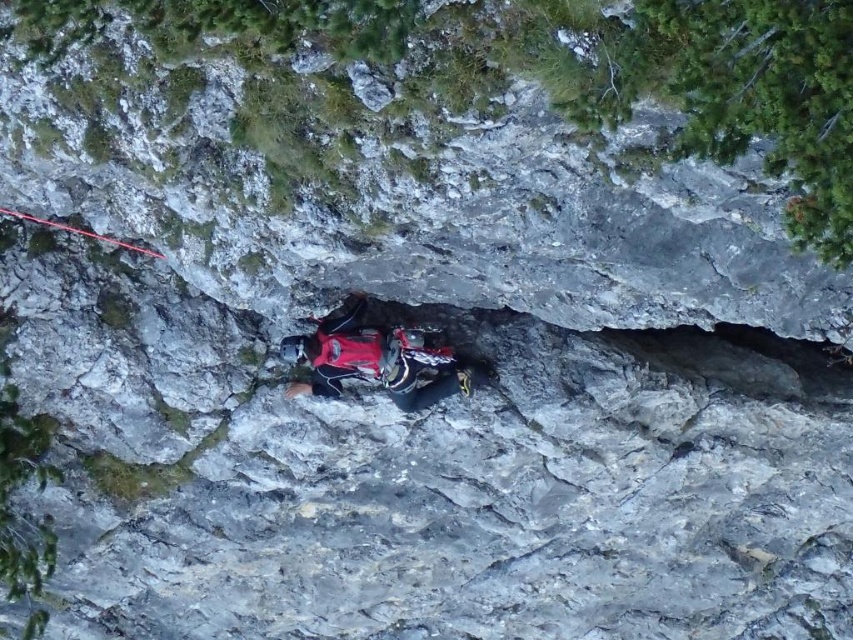
You are a climber attempting to reach a specific point on the rock face. You have a rope that is 5 meters long. If you are standing at the base of the rock, can you safely reach the point at coordinates point (445, 355) with your rope?

The point at coordinates point (445, 355) is 4.71 meters away from the viewer. Since the rope is 5 meters long, it is long enough to safely reach the point.

You are a safety inspector reviewing a climbing setup. You observe the red fabric harness at center and the red nylon rope at upper left in the scene. Based on standard safety protocols, which item should be above the other to ensure proper belaying?

The red nylon rope at upper left should be positioned above the red fabric harness at center to ensure proper belaying, as the harness needs to be below the anchor point for safe operation.